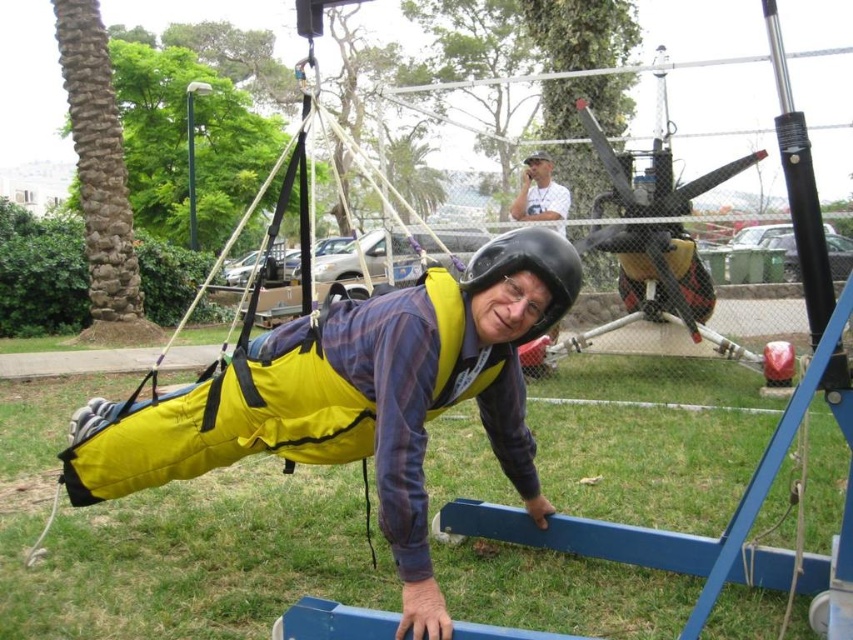
Question: Which of the following is the closest to the observer?

Choices:
 (A) yellow fabric at center
 (B) white cotton shirt at upper center
 (C) black matte helmet at center

Answer: (A)

Question: Does yellow fabric at center lie in front of white cotton shirt at upper center?

Choices:
 (A) no
 (B) yes

Answer: (B)

Question: Based on their relative distances, which object is nearer to the white cotton shirt at upper center?

Choices:
 (A) yellow fabric at center
 (B) black matte helmet at center

Answer: (A)

Question: Among these objects, which one is farthest from the camera?

Choices:
 (A) yellow fabric at center
 (B) white cotton shirt at upper center
 (C) black matte helmet at center

Answer: (B)

Question: Is yellow fabric at center above black matte helmet at center?

Choices:
 (A) no
 (B) yes

Answer: (A)

Question: Can you confirm if yellow fabric at center is smaller than black matte helmet at center?

Choices:
 (A) yes
 (B) no

Answer: (B)